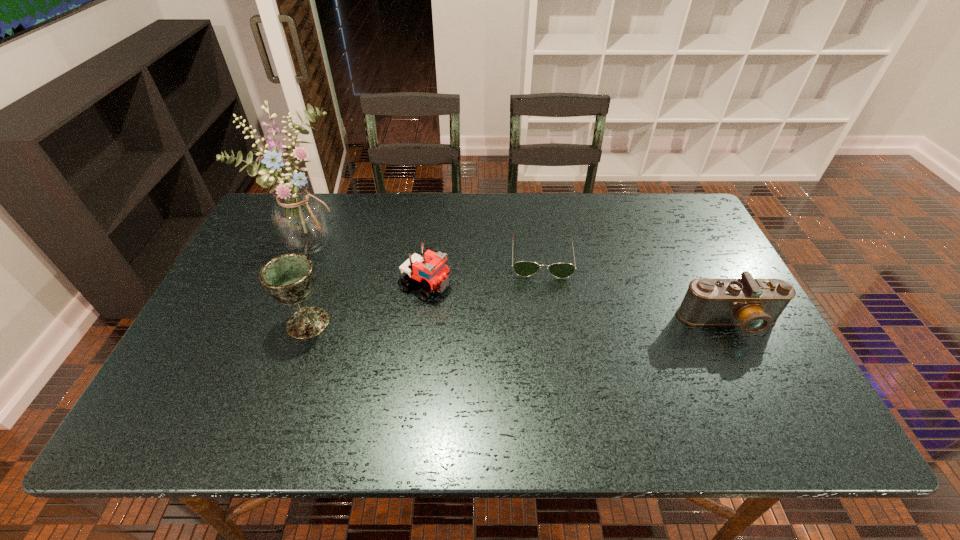
I want to click on object that is at the right edge, so click(754, 305).

Where is `object at the far left corner`? object at the far left corner is located at coordinates (300, 219).

In the image, there is a desktop. Identify the location of free space at the far edge. (461, 227).

Where is `vacant space at the near edge of the desktop`? Image resolution: width=960 pixels, height=540 pixels. vacant space at the near edge of the desktop is located at coordinates (252, 386).

Where is `vacant space at the left edge of the desktop`? The width and height of the screenshot is (960, 540). vacant space at the left edge of the desktop is located at coordinates (218, 295).

In the image, there is a desktop. At what (x,y) coordinates should I click in order to perform the action: click on free space at the right edge. Please return your answer as a coordinate pair (x, y). Image resolution: width=960 pixels, height=540 pixels. Looking at the image, I should click on (705, 267).

Find the location of a particular element. This screenshot has width=960, height=540. vacant region at the far right corner of the desktop is located at coordinates (680, 215).

Identify the location of unoccupied position between the sunglasses and the camera. (636, 289).

The width and height of the screenshot is (960, 540). Identify the location of empty space between the second object from right to left and the Lego. (483, 271).

What are the coordinates of `vacant space in between the rightmost object and the chalice` in the screenshot? It's located at (518, 322).